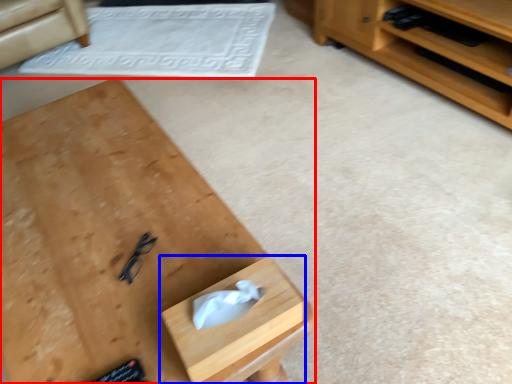
Question: Among these objects, which one is nearest to the camera, desk (highlighted by a red box) or drawer (highlighted by a blue box)?

Choices:
 (A) desk
 (B) drawer

Answer: (A)